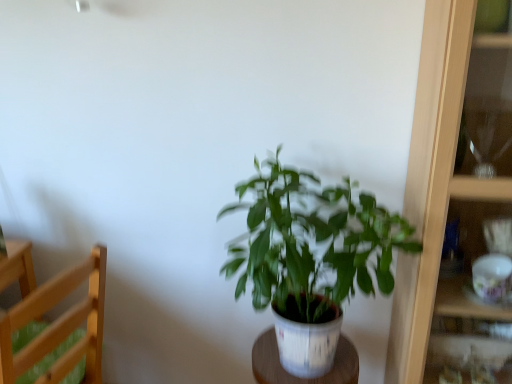
Question: Can you confirm if light wood chair at left is thinner than wooden cabinet at right?

Choices:
 (A) no
 (B) yes

Answer: (A)

Question: From a real-world perspective, is light wood chair at left positioned under wooden cabinet at right based on gravity?

Choices:
 (A) yes
 (B) no

Answer: (A)

Question: Is light wood chair at left turned away from wooden cabinet at right?

Choices:
 (A) yes
 (B) no

Answer: (B)

Question: Does light wood chair at left come behind wooden cabinet at right?

Choices:
 (A) no
 (B) yes

Answer: (B)

Question: Is light wood chair at left shorter than wooden cabinet at right?

Choices:
 (A) yes
 (B) no

Answer: (A)

Question: Is white wood table at center situated inside light wood chair at left or outside?

Choices:
 (A) outside
 (B) inside

Answer: (A)

Question: Based on their sizes in the image, would you say white wood table at center is bigger or smaller than light wood chair at left?

Choices:
 (A) small
 (B) big

Answer: (A)

Question: Is white wood table at center in front of or behind light wood chair at left in the image?

Choices:
 (A) front
 (B) behind

Answer: (B)

Question: In terms of height, does white wood table at center look taller or shorter compared to light wood chair at left?

Choices:
 (A) tall
 (B) short

Answer: (B)

Question: Based on their sizes in the image, would you say light wood chair at left is bigger or smaller than green matte plant at center?

Choices:
 (A) small
 (B) big

Answer: (A)

Question: Is light wood chair at left situated inside green matte plant at center or outside?

Choices:
 (A) inside
 (B) outside

Answer: (B)

Question: Relative to green matte plant at center, is light wood chair at left in front or behind?

Choices:
 (A) behind
 (B) front

Answer: (A)

Question: From the image's perspective, is light wood chair at left positioned above or below green matte plant at center?

Choices:
 (A) above
 (B) below

Answer: (B)

Question: Is point (252, 367) positioned closer to the camera than point (328, 249)?

Choices:
 (A) closer
 (B) farther

Answer: (B)

Question: Considering the positions of white wood table at center and green matte plant at center in the image, is white wood table at center wider or thinner than green matte plant at center?

Choices:
 (A) thin
 (B) wide

Answer: (A)